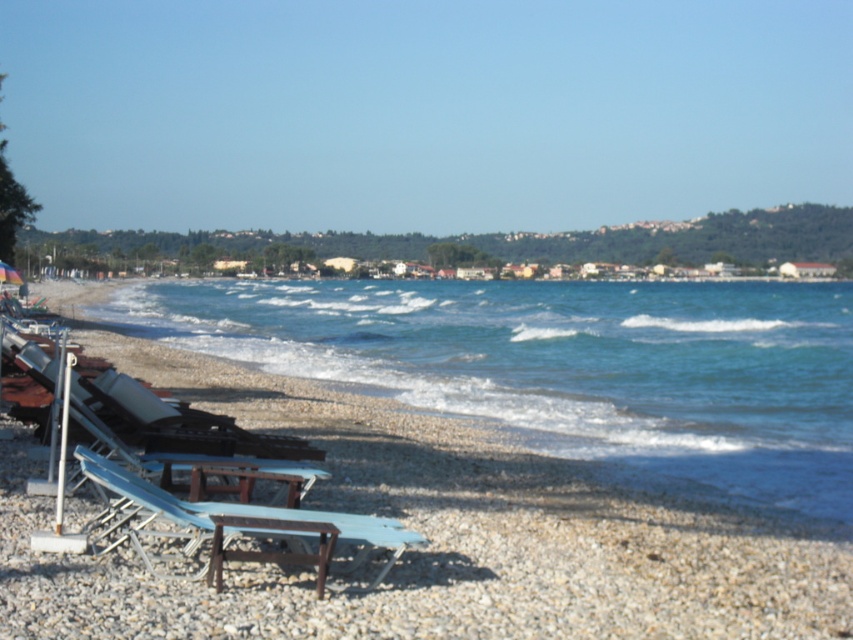
Which is more to the right, light blue plastic beach chair at lower left or transparent plastic umbrella at lower left?

Positioned to the right is light blue plastic beach chair at lower left.

Which is behind, point (115, 540) or point (25, 291)?

The point (25, 291) is behind.

Looking at this image, who is more forward, (x=300, y=554) or (x=6, y=275)?

Point (x=300, y=554)

At what (x,y) coordinates should I click in order to perform the action: click on light blue plastic beach chair at lower left. Please return your answer as a coordinate pair (x, y). Looking at the image, I should click on [x=236, y=525].

Between point (263, 308) and point (328, 550), which one is positioned in front?

Positioned in front is point (328, 550).

Can you confirm if blue water at lower left is positioned below light blue plastic beach chair at lower left?

Actually, blue water at lower left is above light blue plastic beach chair at lower left.

This screenshot has height=640, width=853. Identify the location of blue water at lower left. (567, 364).

Who is lower down, blue water at lower left or transparent plastic umbrella at lower left?

blue water at lower left is below.

From the picture: Is blue water at lower left bigger than transparent plastic umbrella at lower left?

Yes.

Who is more forward, [669,381] or [7,269]?

Positioned in front is point [669,381].

Identify the location of blue water at lower left. (567, 364).